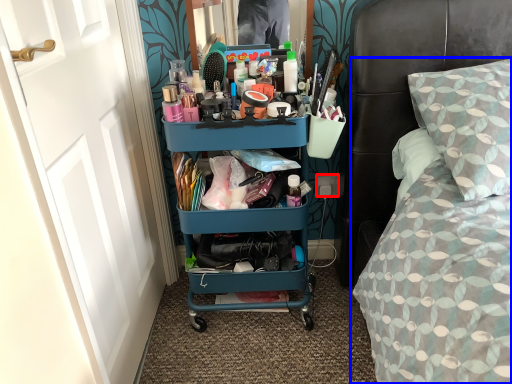
Question: Which object appears closest to the camera in this image, power outlet (highlighted by a red box) or bed (highlighted by a blue box)?

Choices:
 (A) power outlet
 (B) bed

Answer: (B)